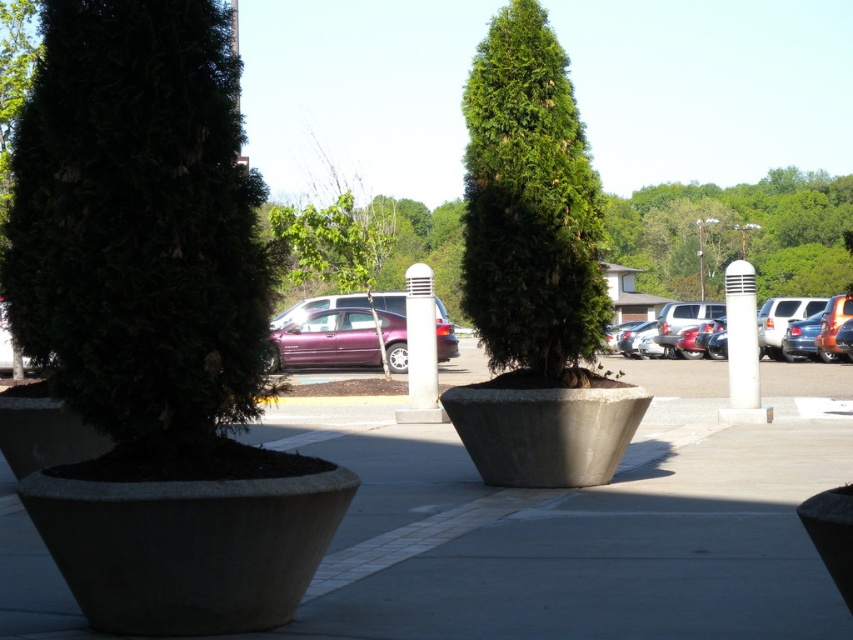
Measure the distance between point (479, 99) and camera.

They are 10.59 meters apart.

Is green leafy tree at center further to the viewer compared to metallic purple sedan at center?

Yes.

Locate an element on the screen. The width and height of the screenshot is (853, 640). green leafy tree at center is located at coordinates point(531,211).

Measure the distance from concrete at center to green matte tree at left.

3.65 meters

Does concrete at center have a lesser width compared to green matte tree at left?

Incorrect, concrete at center's width is not less than green matte tree at left's.

Where is `concrete at center`? Image resolution: width=853 pixels, height=640 pixels. concrete at center is located at coordinates (582, 541).

I want to click on concrete at center, so click(x=582, y=541).

Does green matte tree at left appear under green leafy tree at center?

Yes, green matte tree at left is below green leafy tree at center.

Who is shorter, green matte tree at left or green leafy tree at center?

Standing shorter between the two is green matte tree at left.

Who is more distant from viewer, (x=169, y=307) or (x=503, y=100)?

The point (x=503, y=100) is behind.

This screenshot has width=853, height=640. Identify the location of green matte tree at left. (134, 234).